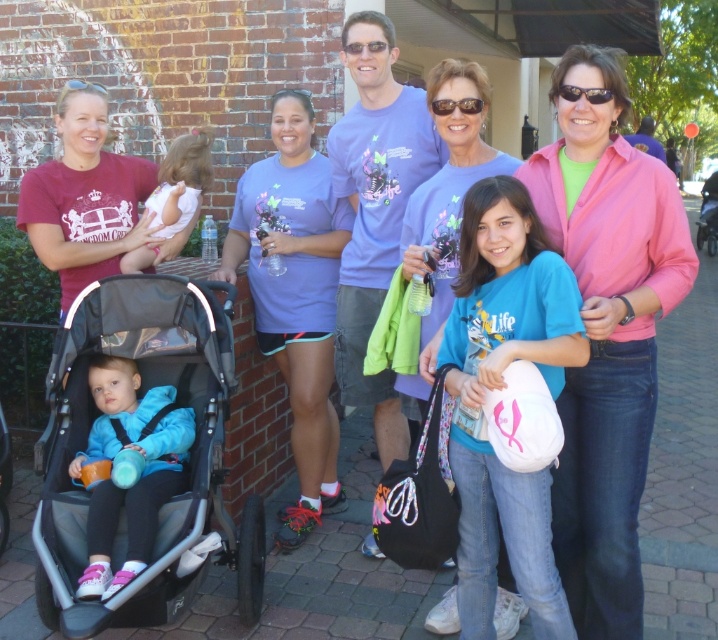
Looking at this image, does pink satin jacket at center have a lesser height compared to matte blue jacket at lower left?

No.

Does point (574, 108) come farther from viewer compared to point (144, 563)?

No, (574, 108) is in front of (144, 563).

Is point (584, 312) behind point (149, 513)?

No, it is not.

You are a GUI agent. You are given a task and a screenshot of the screen. Output one action in this format:
    pyautogui.click(x=<x>, y=<y>)
    Task: Click on the pink satin jacket at center
    The width and height of the screenshot is (718, 640).
    Given the screenshot: What is the action you would take?
    pyautogui.click(x=606, y=330)

Is point (342, 282) in front of point (202, 152)?

No.

Image resolution: width=718 pixels, height=640 pixels. Describe the element at coordinates (376, 209) in the screenshot. I see `matte blue t-shirt at center` at that location.

Does point (359, 161) come closer to viewer compared to point (172, 157)?

Yes, it is in front of point (172, 157).

Where is `matte blue t-shirt at center`? The height and width of the screenshot is (640, 718). matte blue t-shirt at center is located at coordinates (376, 209).

Who is higher up, blue matte shirt at center or matte blue t-shirt at center?

matte blue t-shirt at center is above.

Measure the distance between blue matte shirt at center and camera.

A distance of 7.21 feet exists between blue matte shirt at center and camera.

Who is more forward, (x=564, y=618) or (x=376, y=301)?

Point (x=564, y=618)

This screenshot has height=640, width=718. In order to click on blue matte shirt at center in this screenshot , I will do `click(500, 387)`.